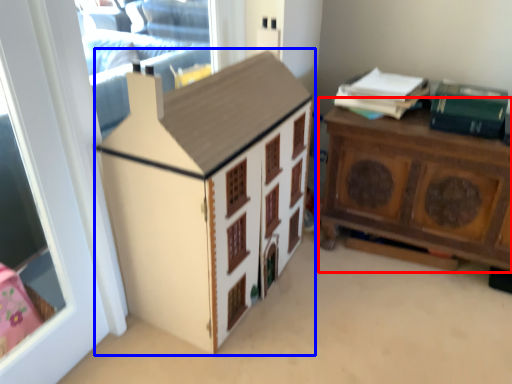
Question: Which of the following is the closest to the observer, nightstand (highlighted by a red box) or cabinetry (highlighted by a blue box)?

Choices:
 (A) nightstand
 (B) cabinetry

Answer: (B)